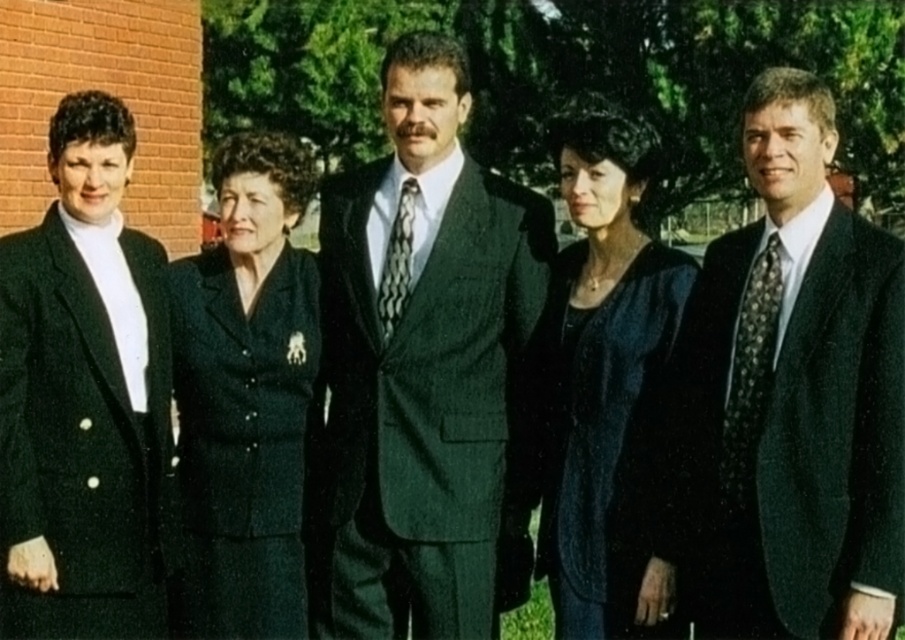
Image resolution: width=905 pixels, height=640 pixels. What do you see at coordinates (599, 365) in the screenshot?
I see `velvet black coat at center` at bounding box center [599, 365].

Is point (580, 369) positioned in front of point (751, 364)?

No.

Locate an element on the screen. velvet black coat at center is located at coordinates coord(599,365).

Can you confirm if dark green suit at center is positioned to the right of dark green textured suit at center?

Yes, dark green suit at center is to the right of dark green textured suit at center.

Between dark green suit at center and dark green textured suit at center, which one is positioned lower?

dark green suit at center is below.

Who is more distant from viewer, (470, 461) or (227, 268)?

The point (227, 268) is behind.

Locate an element on the screen. The height and width of the screenshot is (640, 905). dark green suit at center is located at coordinates (420, 358).

Is point (772, 440) closer to camera compared to point (719, 483)?

Yes, it is in front of point (719, 483).

Does point (824, 195) lie in front of point (753, 484)?

No, it is behind (753, 484).

Where is `matte black suit at center`? The image size is (905, 640). matte black suit at center is located at coordinates (792, 397).